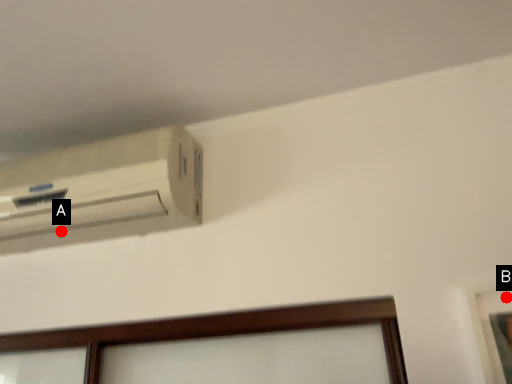
Question: Two points are circled on the image, labeled by A and B beside each circle. Which point is farther from the camera taking this photo?

Choices:
 (A) A is further
 (B) B is further

Answer: (A)